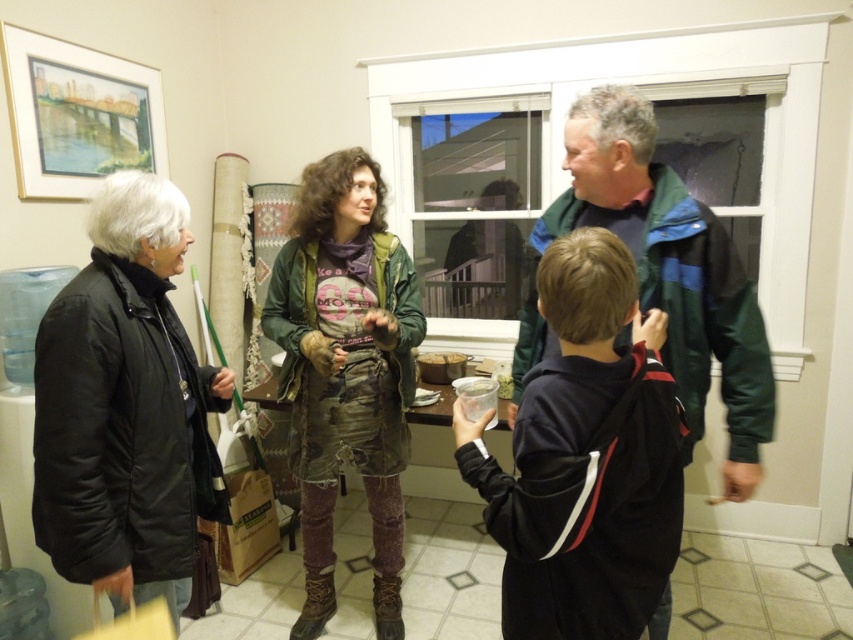
Between point (583, 156) and point (434, 358), which one is positioned behind?

Point (434, 358)

Which is above, green jacket at center or translucent plastic cup at center?

Positioned higher is green jacket at center.

Is point (582, 225) positioned after point (440, 358)?

No, it is in front of (440, 358).

Where is `green jacket at center`? This screenshot has height=640, width=853. green jacket at center is located at coordinates (660, 275).

In the scene shown: Does rusty leather jacket at center have a lesser height compared to translucent plastic cup at center?

No, rusty leather jacket at center is not shorter than translucent plastic cup at center.

Does rusty leather jacket at center appear on the right side of translucent plastic cup at center?

Incorrect, rusty leather jacket at center is not on the right side of translucent plastic cup at center.

Between point (312, 557) and point (450, 356), which one is positioned behind?

The point (450, 356) is behind.

Find the location of a particular element. rusty leather jacket at center is located at coordinates (345, 371).

Can you confirm if black puffy jacket at left is smaller than green jacket at center?

Yes, black puffy jacket at left is smaller than green jacket at center.

Can you confirm if black puffy jacket at left is taller than green jacket at center?

Correct, black puffy jacket at left is much taller as green jacket at center.

Is point (91, 237) positioned before point (755, 305)?

Yes, it is in front of point (755, 305).

Find the location of a particular element. Image resolution: width=853 pixels, height=640 pixels. black puffy jacket at left is located at coordinates (125, 406).